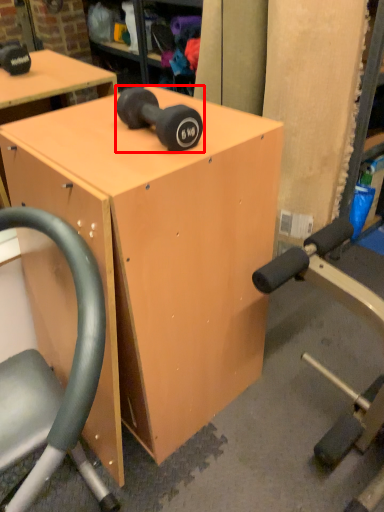
Question: Considering the relative positions of dumbbell (annotated by the red box) and table in the image provided, where is dumbbell (annotated by the red box) located with respect to the staircase?

Choices:
 (A) left
 (B) right

Answer: (B)